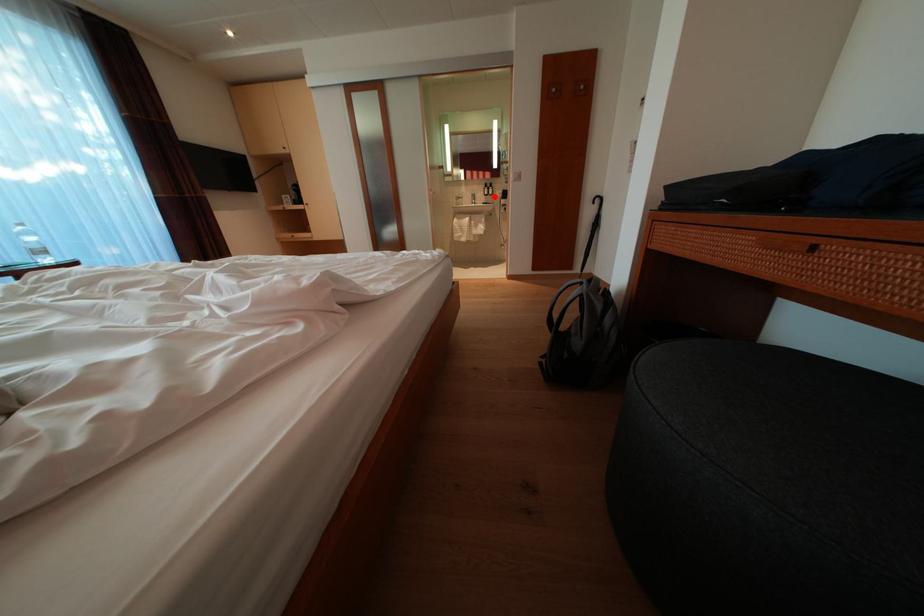
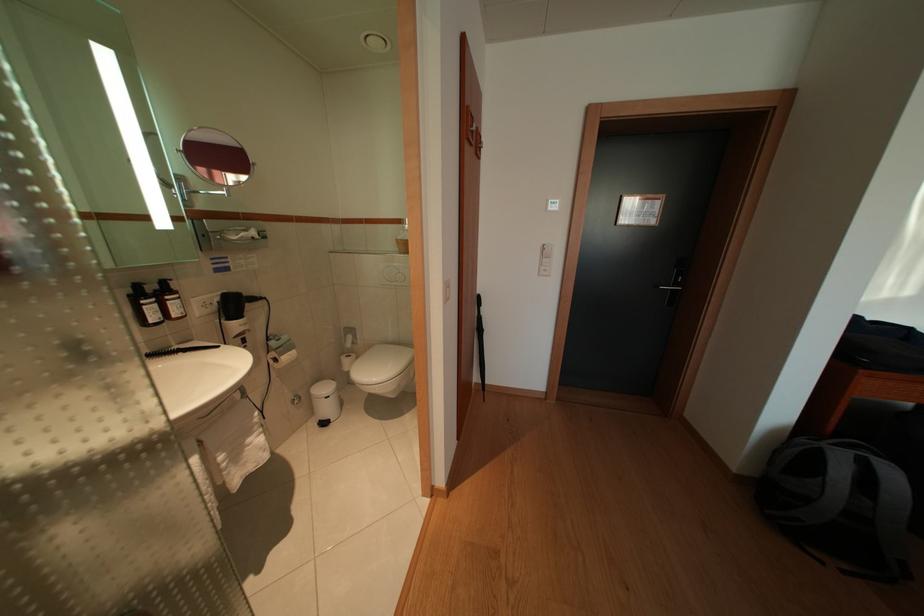
Question: I am providing you with two images of the same scene from different viewpoints. Given a red point in image1, look at the same physical point in image2. Is it:

Choices:
 (A) Closer to the viewpoint
 (B) Farther from the viewpoint

Answer: (B)